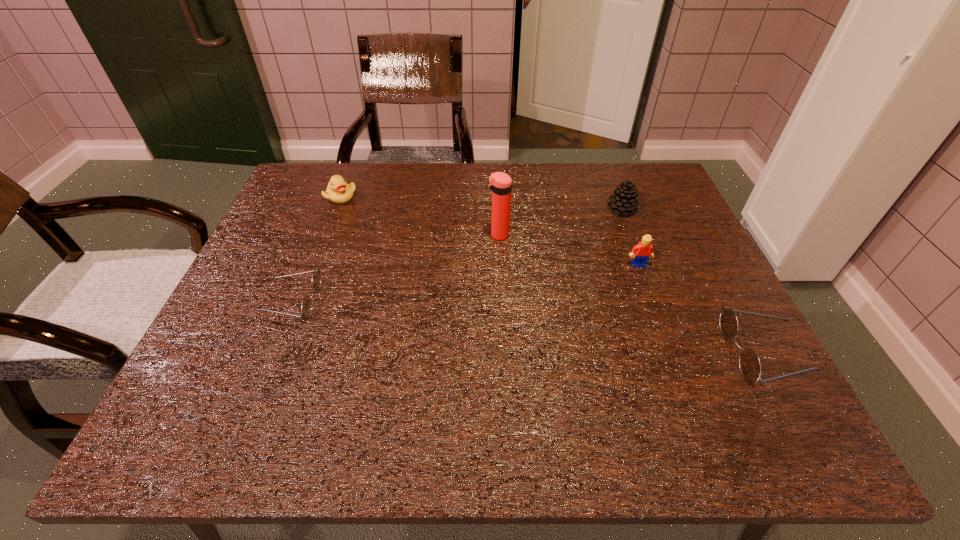
Locate an element on the screen. Image resolution: width=960 pixels, height=540 pixels. vacant space positioned 0.060m on the front-facing side of the shortest object is located at coordinates (243, 302).

Identify the location of vacant space located at the narrow end of the pinecone. (646, 275).

The image size is (960, 540). I want to click on vacant space situated on the left of the third object from left to right, so click(450, 235).

This screenshot has width=960, height=540. In order to click on free space located 0.320m on the front-facing side of the duckling in this screenshot , I will do pyautogui.click(x=306, y=287).

The width and height of the screenshot is (960, 540). I want to click on vacant space located on the face of the Lego, so click(x=686, y=393).

You are a GUI agent. You are given a task and a screenshot of the screen. Output one action in this format:
    pyautogui.click(x=<x>, y=<y>)
    Task: Click on the pinecone at the far edge
    This screenshot has height=540, width=960.
    Given the screenshot: What is the action you would take?
    pyautogui.click(x=624, y=199)

Where is `duckling at the far edge`? duckling at the far edge is located at coordinates (338, 191).

Locate an element on the screen. Image resolution: width=960 pixels, height=540 pixels. object at the near edge is located at coordinates 750,367.

Image resolution: width=960 pixels, height=540 pixels. In order to click on spectacles located at the left edge in this screenshot , I will do `click(306, 308)`.

The image size is (960, 540). What are the coordinates of `duckling located at the left edge` in the screenshot? It's located at (338, 191).